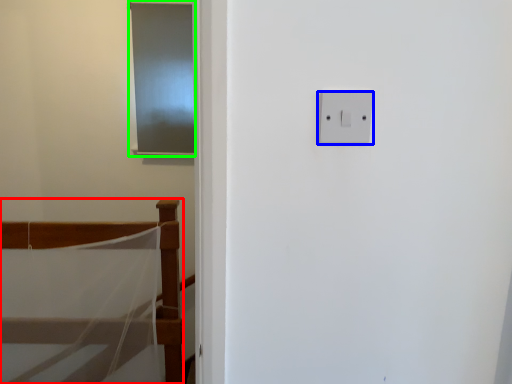
Question: Which object is positioned closest to furniture (highlighted by a red box)? Select from light switch (highlighted by a blue box) and screen door (highlighted by a green box).

Choices:
 (A) light switch
 (B) screen door

Answer: (B)